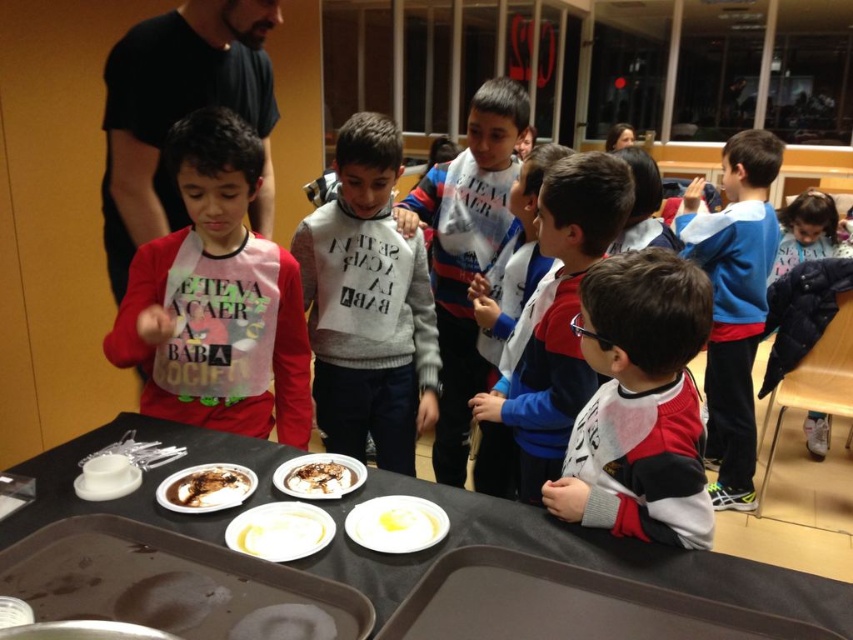
You are a photographer standing at the back of the room. You want to take a photo of the yellow creamy food at lower center without any obstructions. Is the black puffer jacket at upper right blocking your view of it?

The black puffer jacket at upper right is taller than the yellow creamy food at lower center, so it would block the view of the yellow creamy food at lower center from your position at the back.

You are a teacher organizing a cooking class. You have a dark brown plastic tray at lower left and a white matte plate at center on the table. Which object can accommodate a larger portion of food?

The dark brown plastic tray at lower left can accommodate a larger portion of food because its width surpasses that of the white matte plate at center.